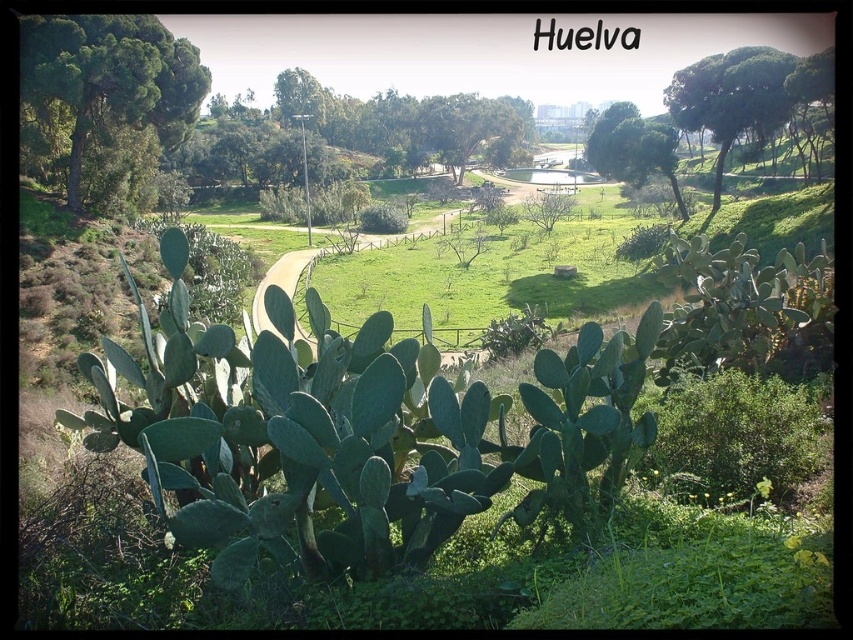
Question: Among these points, which one is nearest to the camera?

Choices:
 (A) (627, 129)
 (B) (692, 109)

Answer: (B)

Question: Which point is closer to the camera?

Choices:
 (A) (45, 104)
 (B) (807, 93)
 (C) (379, 113)
 (D) (674, 160)

Answer: (A)

Question: Which object is positioned closest to the green leafy tree at upper left?

Choices:
 (A) green leafy tree at upper center
 (B) green leafy tree at upper right
 (C) green leafy tree at center

Answer: (A)

Question: Is green leafy tree at upper right positioned at the back of green leafy tree at upper center?

Choices:
 (A) yes
 (B) no

Answer: (B)

Question: Can you confirm if green leafy tree at upper left is smaller than green leafy tree at upper center?

Choices:
 (A) no
 (B) yes

Answer: (B)

Question: Can you confirm if green leafy tree at upper left is thinner than green leafy tree at upper right?

Choices:
 (A) yes
 (B) no

Answer: (A)